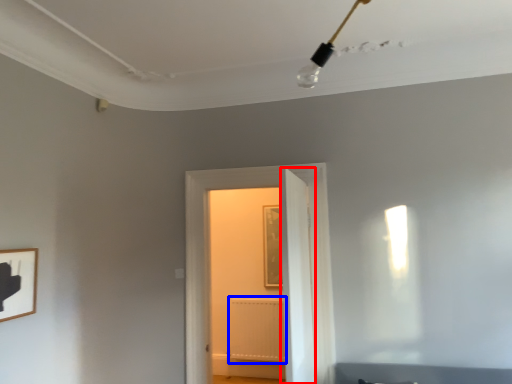
Question: Among these objects, which one is farthest to the camera, door (highlighted by a red box) or radiator (highlighted by a blue box)?

Choices:
 (A) door
 (B) radiator

Answer: (B)